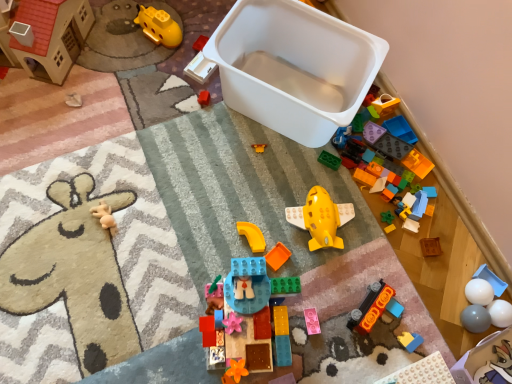
I want to click on vacant space in between cardboard house at upper left, the 1th toy positioned from the left, and translucent blue plastic building block at center, the 12th toy from the right, so click(x=131, y=177).